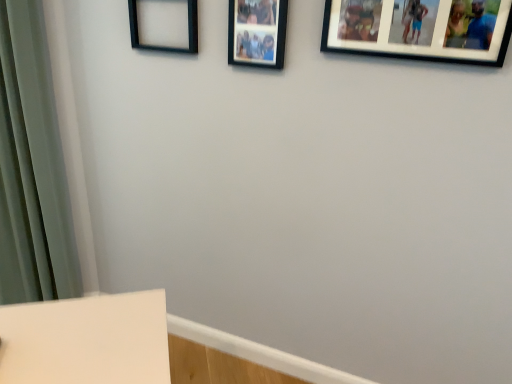
Question: In which direction should I rotate to look at black matte picture frame at upper center, the 2th picture frame from the right?

Choices:
 (A) left
 (B) right

Answer: (B)

Question: Can you confirm if black matte picture frame at upper right, the first picture frame when ordered from right to left, is wider than black matte picture frame at upper left, the 3th picture frame when ordered from right to left?

Choices:
 (A) no
 (B) yes

Answer: (B)

Question: Is black matte picture frame at upper right, the first picture frame when ordered from right to left, further to camera compared to black matte picture frame at upper left, the 3th picture frame when ordered from right to left?

Choices:
 (A) yes
 (B) no

Answer: (B)

Question: Is black matte picture frame at upper right, the third picture frame in the left-to-right sequence, shorter than black matte picture frame at upper left, the 3th picture frame when ordered from right to left?

Choices:
 (A) no
 (B) yes

Answer: (B)

Question: From a real-world perspective, is black matte picture frame at upper right, the first picture frame when ordered from right to left, on black matte picture frame at upper left, acting as the first picture frame starting from the left?

Choices:
 (A) no
 (B) yes

Answer: (B)

Question: Does black matte picture frame at upper right, the first picture frame when ordered from right to left, have a lesser width compared to black matte picture frame at upper left, acting as the first picture frame starting from the left?

Choices:
 (A) yes
 (B) no

Answer: (B)

Question: Considering the relative positions of black matte picture frame at upper right, the third picture frame in the left-to-right sequence, and black matte picture frame at upper left, the 3th picture frame when ordered from right to left, in the image provided, is black matte picture frame at upper right, the third picture frame in the left-to-right sequence, to the right of black matte picture frame at upper left, the 3th picture frame when ordered from right to left, from the viewer's perspective?

Choices:
 (A) no
 (B) yes

Answer: (B)

Question: Is black matte picture frame at upper center, the second picture frame from the left, with black matte picture frame at upper right, the first picture frame when ordered from right to left?

Choices:
 (A) yes
 (B) no

Answer: (B)

Question: From a real-world perspective, is black matte picture frame at upper center, the 2th picture frame from the right, beneath black matte picture frame at upper right, the first picture frame when ordered from right to left?

Choices:
 (A) no
 (B) yes

Answer: (B)

Question: Does black matte picture frame at upper center, the 2th picture frame from the right, come behind black matte picture frame at upper right, the first picture frame when ordered from right to left?

Choices:
 (A) no
 (B) yes

Answer: (B)

Question: Is black matte picture frame at upper center, the 2th picture frame from the right, taller than black matte picture frame at upper right, the third picture frame in the left-to-right sequence?

Choices:
 (A) yes
 (B) no

Answer: (A)

Question: Is black matte picture frame at upper center, the second picture frame from the left, bigger than black matte picture frame at upper right, the third picture frame in the left-to-right sequence?

Choices:
 (A) yes
 (B) no

Answer: (B)

Question: Would you say black matte picture frame at upper right, the third picture frame in the left-to-right sequence, is part of black matte picture frame at upper center, the second picture frame from the left,'s contents?

Choices:
 (A) no
 (B) yes

Answer: (A)

Question: Can you confirm if black matte picture frame at upper left, acting as the first picture frame starting from the left, is taller than black matte picture frame at upper center, the second picture frame from the left?

Choices:
 (A) yes
 (B) no

Answer: (B)